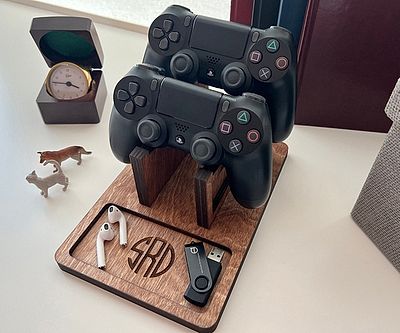
Where is `beige fabric box`? beige fabric box is located at coordinates (375, 191).